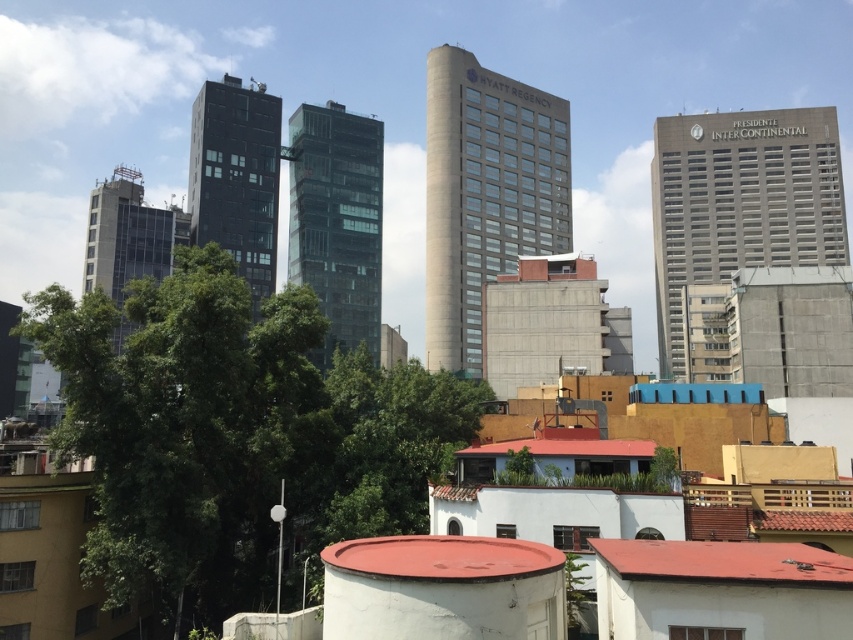
You are a drone operator who needs to deliver a package from the gray concrete building at upper right to the glassy black building at center. The drone has a maximum range of 75 meters. Can the drone complete the delivery without needing a recharge?

The gray concrete building at upper right is 74.97 meters from the glassy black building at center, so yes, the drone can complete the delivery without needing a recharge since the distance is within its 75 meter range.

You are a city planner assessing the skyline for new construction. You see the gray concrete building at upper right and the glassy black building at center. Which one would require a crane with a higher lifting capacity if you were to add a new floor to it?

The gray concrete building at upper right is taller than the glassy black building at center, so adding a new floor to the gray concrete building at upper right would require a crane with a higher lifting capacity because it is taller and likely requires reaching greater heights.

You are a city planner assessing the space between two key structures in the image. The structures are the green leafy tree at center and the black glass building at center. If you need to install a new bench that is 1.2 meters wide, will there be enough space between them to place it without moving either structure?

The green leafy tree at center is narrower than the black glass building at center. However, the exact distance between them isn not specified in the provided information. To determine if the bench can fit, you would need to measure the space between the two structures directly.